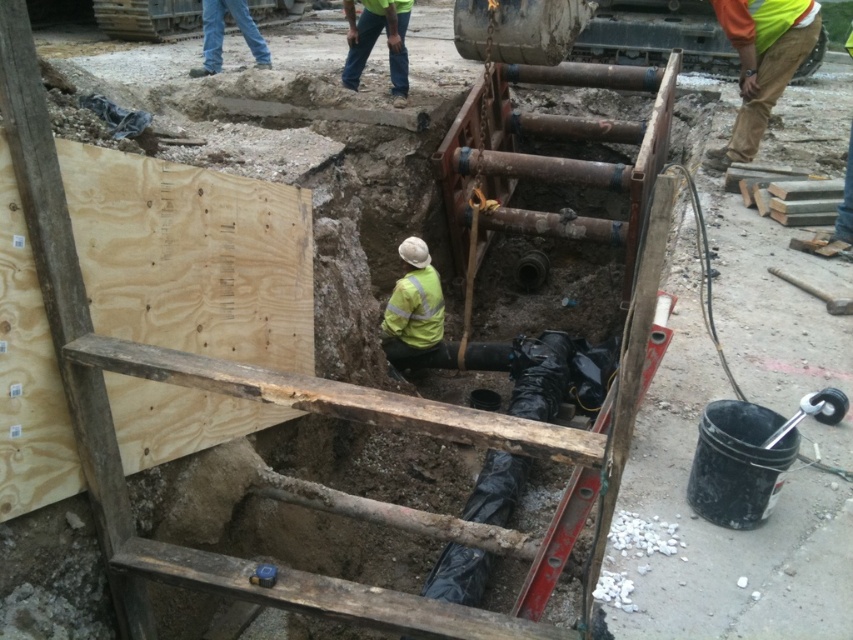
Question: Can you confirm if green reflective jacket at center is smaller than blue jeans at upper left?

Choices:
 (A) no
 (B) yes

Answer: (B)

Question: Which of the following is the closest to the observer?

Choices:
 (A) green reflective jacket at center
 (B) green high-visibility jacket at upper center

Answer: (A)

Question: Which point appears closest to the camera in this image?

Choices:
 (A) (352, 1)
 (B) (234, 10)
 (C) (440, 308)

Answer: (C)

Question: Can you confirm if green high-visibility jacket at upper center is thinner than blue jeans at upper left?

Choices:
 (A) no
 (B) yes

Answer: (B)

Question: Observing the image, what is the correct spatial positioning of green reflective jacket at center in reference to blue jeans at upper left?

Choices:
 (A) above
 (B) below

Answer: (B)

Question: Which object is farther from the camera taking this photo?

Choices:
 (A) green reflective jacket at center
 (B) green high-visibility jacket at upper center
 (C) blue jeans at upper left

Answer: (C)